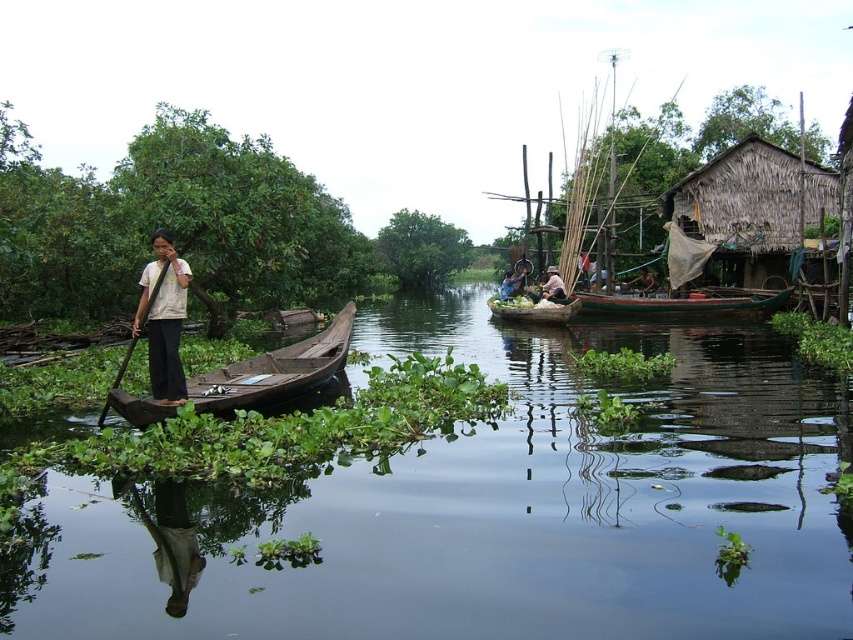
Question: Does green leafy plant at center appear over green wooden canoe at center?

Choices:
 (A) yes
 (B) no

Answer: (A)

Question: Based on their relative distances, which object is nearer to the brown wood paddle at left?

Choices:
 (A) white matte shirt at left
 (B) brown wooden boat at center

Answer: (A)

Question: Which object is closer to the camera taking this photo?

Choices:
 (A) brown wood paddle at left
 (B) thatched straw hut at right
 (C) green wooden canoe at center
 (D) green fabric hat at center

Answer: (A)

Question: Does wooden canoe at left appear on the right side of green fabric hat at center?

Choices:
 (A) no
 (B) yes

Answer: (A)

Question: Which point is closer to the camera?

Choices:
 (A) dark brown wooden boat at center
 (B) wooden canoe at left

Answer: (B)

Question: Does green leafy river at left have a smaller size compared to thatched straw hut at right?

Choices:
 (A) yes
 (B) no

Answer: (A)